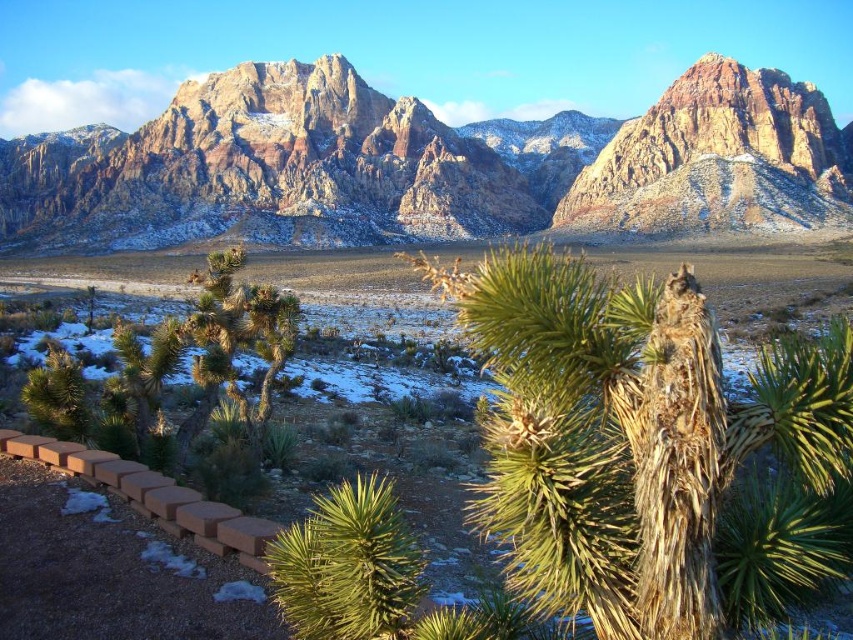
Question: Which of the following is the farthest from the observer?

Choices:
 (A) rugged sandstone mountains at upper center
 (B) green spiky palm tree at lower center

Answer: (A)

Question: Which object is farther from the camera taking this photo?

Choices:
 (A) green spiky palm tree at lower center
 (B) rugged sandstone mountains at upper center

Answer: (B)

Question: In this image, where is rugged sandstone mountains at upper center located relative to green spiky palm tree at lower center?

Choices:
 (A) above
 (B) below

Answer: (A)

Question: Does rugged sandstone mountains at upper center appear on the right side of green spiky palm tree at lower center?

Choices:
 (A) yes
 (B) no

Answer: (B)

Question: Is rugged sandstone mountains at upper center wider than green spiky palm tree at lower center?

Choices:
 (A) no
 (B) yes

Answer: (B)